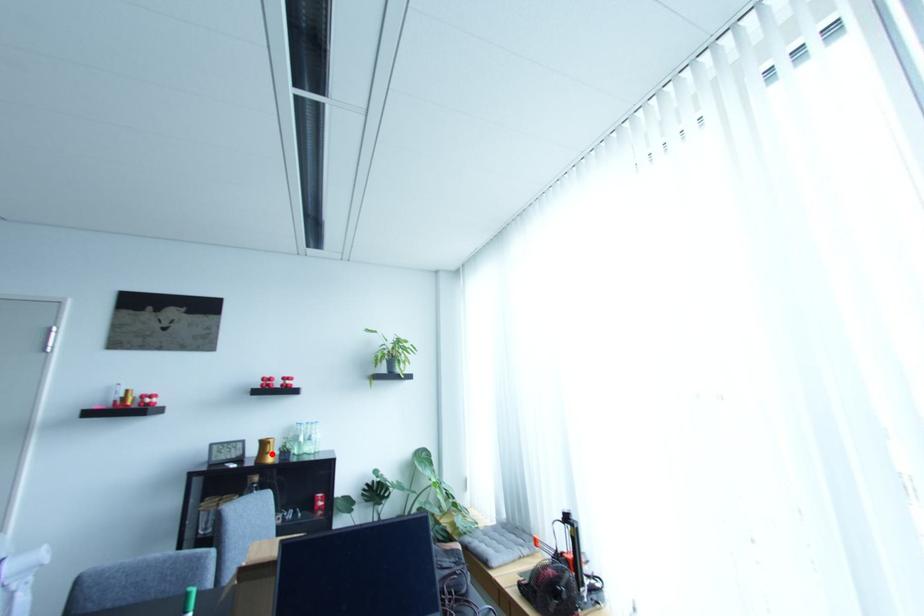
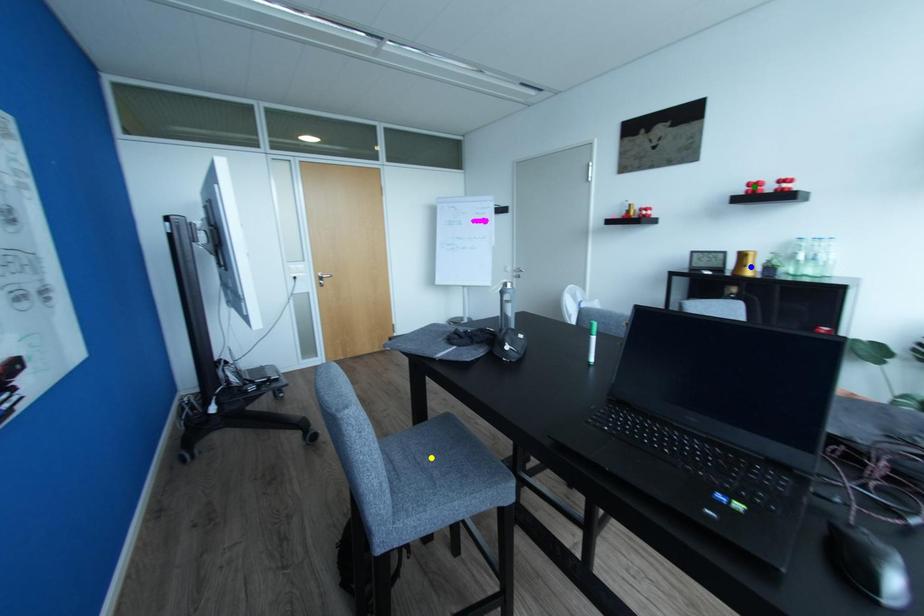
Question: I am providing you with two images of the same scene from different viewpoints. A red point is marked on the first image. You are given multiple points on the second image. Which spot in image 2 lines up with the point in image 1?

Choices:
 (A) blue point
 (B) green point
 (C) yellow point

Answer: (A)